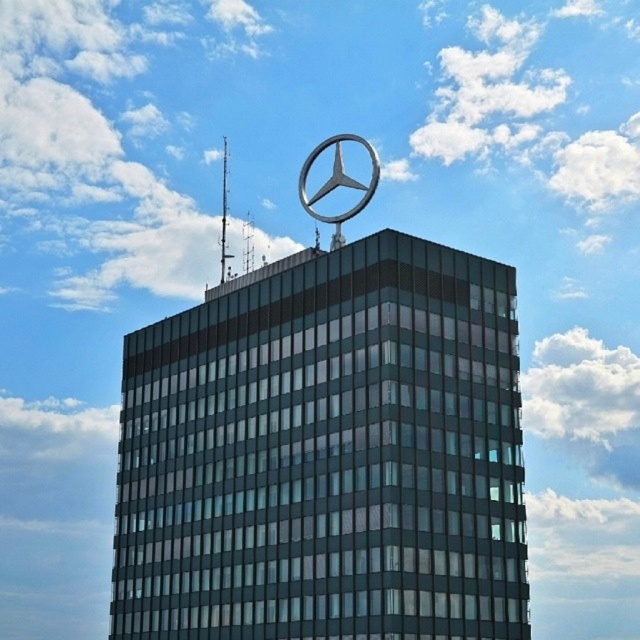
Question: Considering the relative positions of metallic silver mercedes-benz emblem at upper center and metallic silver star at top in the image provided, where is metallic silver mercedes-benz emblem at upper center located with respect to metallic silver star at top?

Choices:
 (A) above
 (B) below

Answer: (B)

Question: Which object appears farthest from the camera in this image?

Choices:
 (A) metallic silver mercedes-benz emblem at upper center
 (B) metallic silver star at top

Answer: (B)

Question: From the image, what is the correct spatial relationship of metallic silver mercedes-benz emblem at upper center in relation to metallic silver star at top?

Choices:
 (A) right
 (B) left

Answer: (B)

Question: Does metallic silver mercedes-benz emblem at upper center appear under metallic silver star at top?

Choices:
 (A) no
 (B) yes

Answer: (B)

Question: Which of the following is the closest to the observer?

Choices:
 (A) metallic silver mercedes-benz emblem at upper center
 (B) metallic silver star at top

Answer: (A)

Question: Which of the following is the closest to the observer?

Choices:
 (A) (470, 376)
 (B) (372, 193)

Answer: (A)